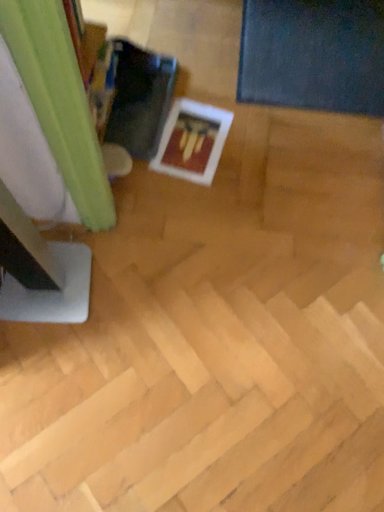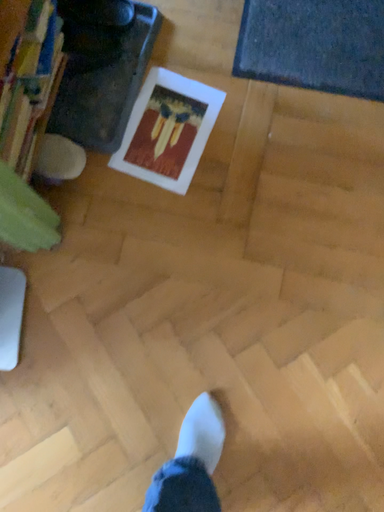
Question: Which way did the camera rotate in the video?

Choices:
 (A) rotated downward
 (B) rotated upward

Answer: (A)